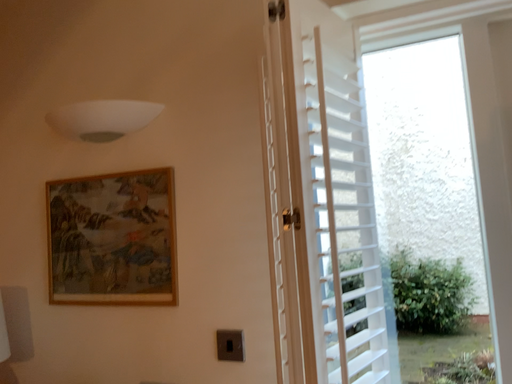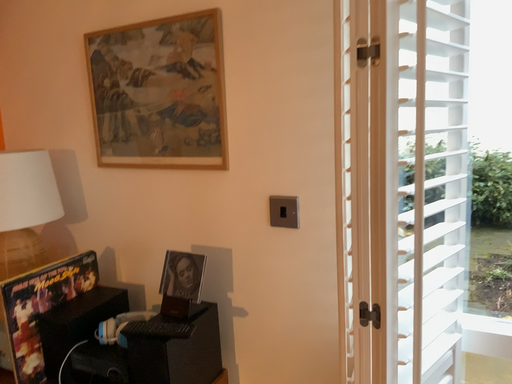
Question: Which way did the camera rotate in the video?

Choices:
 (A) rotated upward
 (B) rotated downward

Answer: (B)